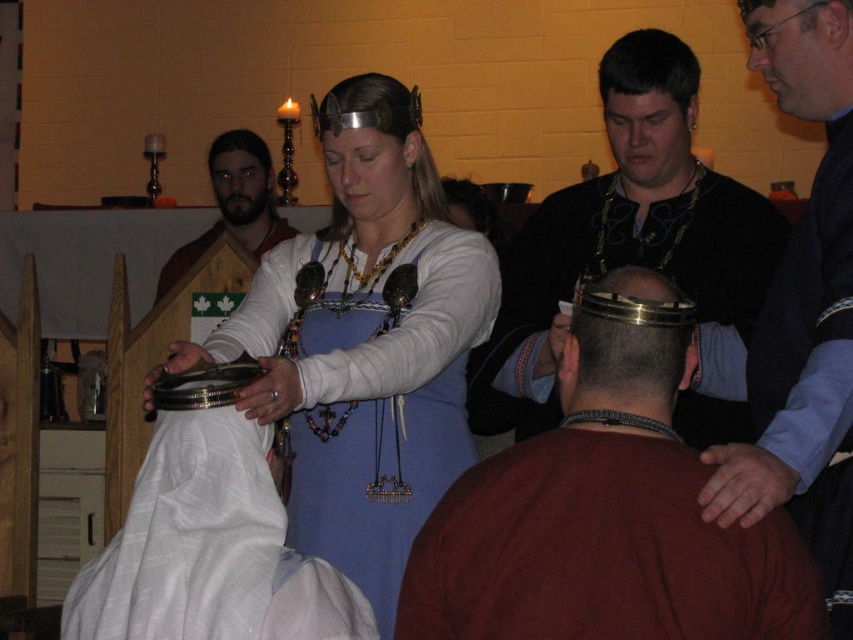
You are an artist trying to sketch the scene. You need to decide the placement of the metallic helmet at center and the matte black head at upper right. Based on their sizes, which one should you draw wider?

The metallic helmet at center might be wider than matte black head at upper right, so you should draw the metallic helmet at center wider.

You are an observer in the scene and want to hand a flower to both the metallic helmet at center and the matte black head at upper right. Since you can only reach objects closer to you, which one can you give the flower to?

The metallic helmet at center is closer to you than the matte black head at upper right, so you can give the flower to the metallic helmet at center.